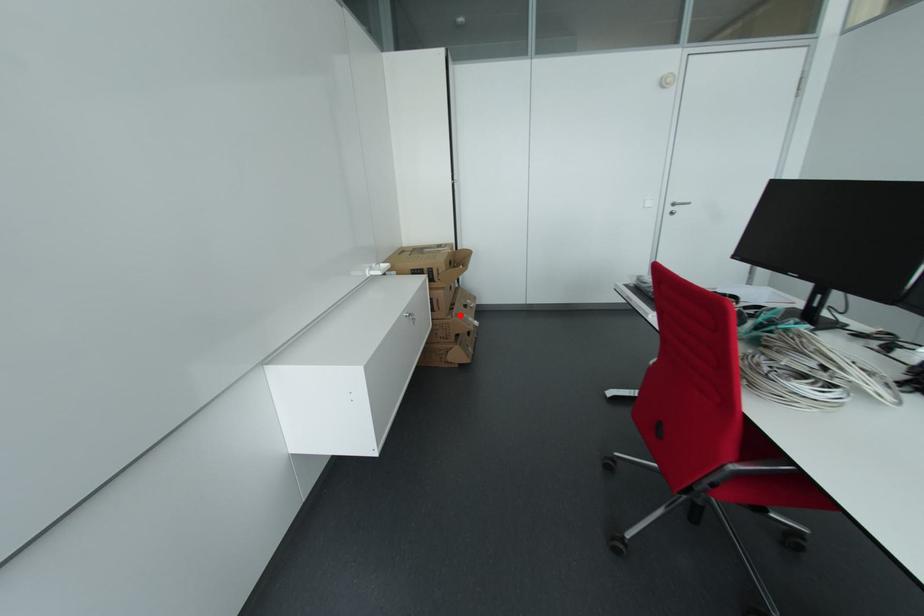
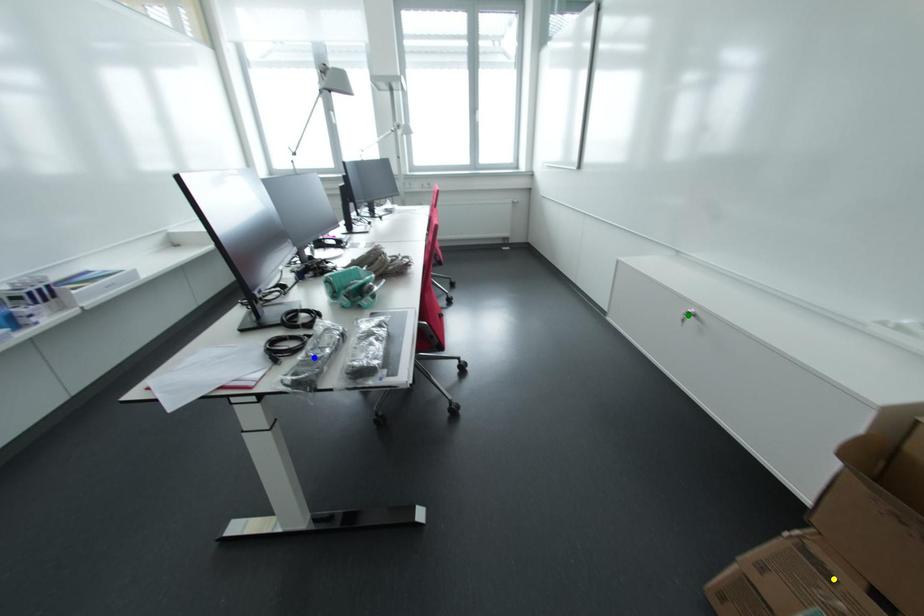
Question: I am providing you with two images of the same scene from different viewpoints. A red point is marked on the first image. You are given multiple points on the second image. Can you choose the point in image 2 that corresponds to the point in image 1?

Choices:
 (A) blue point
 (B) green point
 (C) yellow point

Answer: (C)